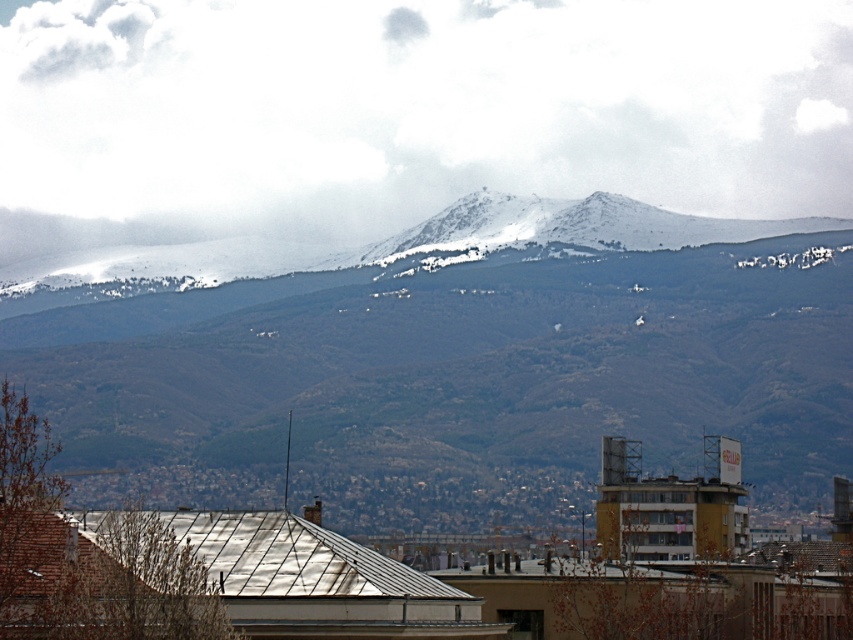
You are an architect designing a new observatory. You want to place it where it can clearly see both the snowy mountain range at upper center and the white fluffy cloud at upper center. Given their positions and sizes, will the observatory have an unobstructed view of both?

The snowy mountain range at upper center is thinner than the white fluffy cloud at upper center. Since the mountain is thinner, it won not block the view of the cloud, so the observatory will have an unobstructed view of both.